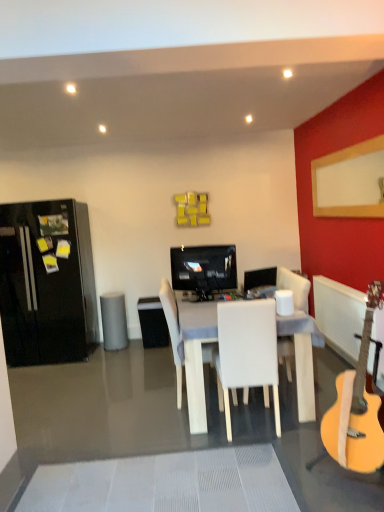
Question: Is gray matte trash bin/can at center wider or thinner than white matte chair at center, marked as the second chair in a back-to-front arrangement?

Choices:
 (A) thin
 (B) wide

Answer: (A)

Question: Is point (107, 322) closer or farther from the camera than point (269, 324)?

Choices:
 (A) closer
 (B) farther

Answer: (B)

Question: Which is nearer to the white wood desk at center?

Choices:
 (A) light brown acoustic guitar at right
 (B) satin black monitor at center
 (C) black glossy refrigerator at left
 (D) gray matte trash bin/can at center
 (E) white leather chair at center, the second chair viewed from the front

Answer: (E)

Question: Estimate the real-world distances between objects in this image. Which object is farther from the satin black monitor at center?

Choices:
 (A) matte black television at center
 (B) white wood desk at center
 (C) white leather chair at center, the first chair viewed from the back
 (D) gray matte trash bin/can at center
 (E) white plastic radiator at right

Answer: (D)